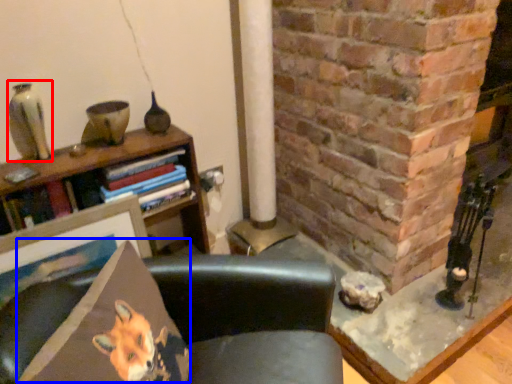
Question: Which point is closer to the camera, gray (highlighted by a red box) or throw pillow (highlighted by a blue box)?

Choices:
 (A) gray
 (B) throw pillow

Answer: (B)